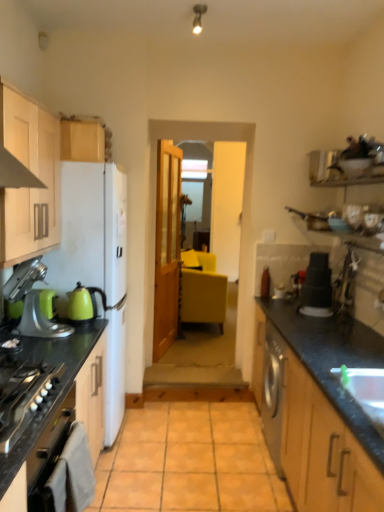
Question: Based on their sizes in the image, would you say matte yellow chair at center is bigger or smaller than matte wood cabinets at left, which appears as the 1th cabinetry when viewed from the front?

Choices:
 (A) small
 (B) big

Answer: (B)

Question: In the image, is matte yellow chair at center on the left side or the right side of matte wood cabinets at left, the second cabinetry when ordered from back to front?

Choices:
 (A) right
 (B) left

Answer: (A)

Question: Which is farther from the black matte oven at lower left?

Choices:
 (A) white glossy sink at lower right
 (B) orange tile at center
 (C) matte black stack at right
 (D) stainless steel oven at left
 (E) black granite countertop at right, the first countertop from the right

Answer: (C)

Question: Which object is the closest to the stainless steel oven at left?

Choices:
 (A) satin nickel faucet at right
 (B) black granite countertop at right, the first countertop from the right
 (C) metallic silver shelf at upper right
 (D) black granite countertop at left, acting as the first countertop starting from the left
 (E) clear glass door at center

Answer: (D)